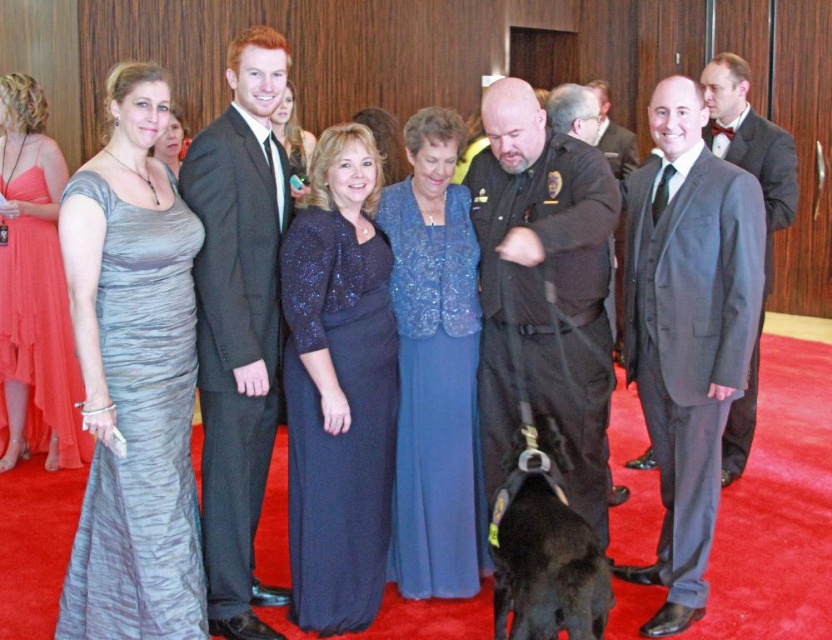
In the image of the red carpet event, there is a woman in a sleeveless silver grey dress on the far left, a man in a dark suit with a white shirt and black tie next to her, and a sparkly dark blue dress at center represented by point (338, 387). Which of these three is positioned furthest to the right?

The sparkly dark blue dress at center represented by point (338, 387) is positioned furthest to the right among the three.

You are a photographer at this event and want to ensure that both the shiny black suit at center and the black uniformed officer at center are clearly visible in your photo. Based on their widths, which one might you need to position closer to the camera to ensure it doesn

The shiny black suit at center has a lesser width compared to the black uniformed officer at center. To ensure both are clearly visible, you might position the shiny black suit at center closer to the camera since its smaller width could make details harder to capture from a distance.